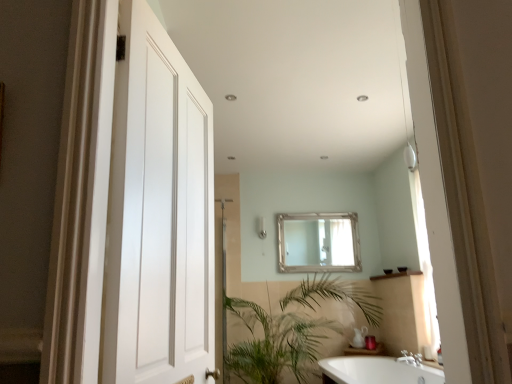
Identify the location of green leafy plant at lower center. (291, 331).

Where is `white glossy bathtub at lower right`? The image size is (512, 384). white glossy bathtub at lower right is located at coordinates (377, 371).

Find the location of `white matte door at left`. white matte door at left is located at coordinates (158, 215).

Does silver metallic mirror at center turn towards white matte door at left?

Yes, silver metallic mirror at center is turned towards white matte door at left.

Considering the relative sizes of silver metallic mirror at center and white matte door at left in the image provided, is silver metallic mirror at center bigger than white matte door at left?

Incorrect, silver metallic mirror at center is not larger than white matte door at left.

Identify the location of door in front of the silver metallic mirror at center. (158, 215).

In terms of size, does silver metallic mirror at center appear bigger or smaller than satin nickel shower at center?

Considering their sizes, silver metallic mirror at center takes up more space than satin nickel shower at center.

From a real-world perspective, which object stands above the other?

From a 3D spatial view, satin nickel shower at center is above.

Consider the image. Could satin nickel shower at center be considered to be inside silver metallic mirror at center?

No, satin nickel shower at center is not a part of silver metallic mirror at center.

From the image's perspective, is silver metallic mirror at center positioned above or below satin nickel shower at center?

silver metallic mirror at center is below satin nickel shower at center.

Considering the relative sizes of green leafy plant at lower center and white matte door at left in the image provided, is green leafy plant at lower center smaller than white matte door at left?

Incorrect, green leafy plant at lower center is not smaller in size than white matte door at left.

From a real-world perspective, which is physically above, green leafy plant at lower center or white matte door at left?

white matte door at left is physically above.

Between green leafy plant at lower center and white matte door at left, which one has less height?

With less height is green leafy plant at lower center.

In the image, is green leafy plant at lower center positioned in front of or behind white matte door at left?

Clearly, green leafy plant at lower center is behind white matte door at left.

In the scene shown: Can you confirm if white matte door at left is positioned to the left of green leafy plant at lower center?

Yes.

How different are the orientations of white matte door at left and green leafy plant at lower center in degrees?

white matte door at left and green leafy plant at lower center are facing 73.9 degrees away from each other.

Considering the sizes of objects white matte door at left and green leafy plant at lower center in the image provided, who is wider, white matte door at left or green leafy plant at lower center?

With larger width is green leafy plant at lower center.

Considering the sizes of satin nickel shower at center and green leafy plant at lower center in the image, is satin nickel shower at center taller or shorter than green leafy plant at lower center?

In the image, satin nickel shower at center appears to be shorter than green leafy plant at lower center.

Is satin nickel shower at center to the left of green leafy plant at lower center from the viewer's perspective?

Yes, satin nickel shower at center is to the left of green leafy plant at lower center.

From the image's perspective, which is above, satin nickel shower at center or green leafy plant at lower center?

satin nickel shower at center, from the image's perspective.

From a real-world perspective, which is physically above, satin nickel shower at center or green leafy plant at lower center?

satin nickel shower at center, from a real-world perspective.

Is satin nickel shower at center smaller than silver metallic mirror at center?

Yes, satin nickel shower at center is smaller than silver metallic mirror at center.

Could you tell me if satin nickel shower at center is turned towards silver metallic mirror at center?

No, satin nickel shower at center is not aimed at silver metallic mirror at center.

From the image's perspective, does satin nickel shower at center appear higher than silver metallic mirror at center?

Yes, from the image's perspective, satin nickel shower at center is over silver metallic mirror at center.

Is satin nickel shower at center far from silver metallic mirror at center?

That's not correct — satin nickel shower at center is a little close to silver metallic mirror at center.

Looking at the image, does green leafy plant at lower center seem bigger or smaller compared to silver metallic mirror at center?

In the image, green leafy plant at lower center appears to be larger than silver metallic mirror at center.

Would you say green leafy plant at lower center is outside silver metallic mirror at center?

Indeed, green leafy plant at lower center is completely outside silver metallic mirror at center.

Is green leafy plant at lower center at the right side of silver metallic mirror at center?

No.

Can you see green leafy plant at lower center touching silver metallic mirror at center?

No, green leafy plant at lower center is not making contact with silver metallic mirror at center.

Find the location of a particular element. mirror that is below the white matte door at left (from the image's perspective) is located at coordinates (318, 242).

The image size is (512, 384). I want to click on mirror located in front of the satin nickel shower at center, so click(318, 242).

Based on their spatial positions, is green leafy plant at lower center or silver metallic mirror at center closer to white matte door at left?

green leafy plant at lower center is positioned closer to the anchor white matte door at left.

Considering their positions, is white glossy bathtub at lower right positioned further to white matte door at left than satin nickel shower at center?

Among the two, satin nickel shower at center is located further to white matte door at left.

Looking at the image, which one is located further to white matte door at left, green leafy plant at lower center or satin nickel shower at center?

Based on the image, satin nickel shower at center appears to be further to white matte door at left.

Based on their spatial positions, is green leafy plant at lower center or white matte door at left closer to satin nickel shower at center?

green leafy plant at lower center is closer to satin nickel shower at center.

Which object lies further to the anchor point satin nickel shower at center, white matte door at left or green leafy plant at lower center?

white matte door at left lies further to satin nickel shower at center than the other object.

Based on the photo, estimate the real-world distances between objects in this image. Which object is closer to white matte door at left, silver metallic mirror at center or white glossy bathtub at lower right?

Among the two, white glossy bathtub at lower right is located nearer to white matte door at left.

Looking at the image, which one is located further to white glossy bathtub at lower right, white matte door at left or satin nickel shower at center?

white matte door at left lies further to white glossy bathtub at lower right than the other object.

Looking at the image, which one is located further to silver metallic mirror at center, green leafy plant at lower center or white matte door at left?

Based on the image, white matte door at left appears to be further to silver metallic mirror at center.

Where is `houseplant between white matte door at left and silver metallic mirror at center from front to back`? This screenshot has height=384, width=512. houseplant between white matte door at left and silver metallic mirror at center from front to back is located at coordinates (291, 331).

The width and height of the screenshot is (512, 384). In order to click on houseplant positioned between white glossy bathtub at lower right and satin nickel shower at center from near to far in this screenshot , I will do `click(291, 331)`.

Locate an element on the screen. bathtub between white matte door at left and green leafy plant at lower center in the front-back direction is located at coordinates (377, 371).

What are the coordinates of `houseplant between white glossy bathtub at lower right and silver metallic mirror at center along the z-axis` in the screenshot? It's located at (291, 331).